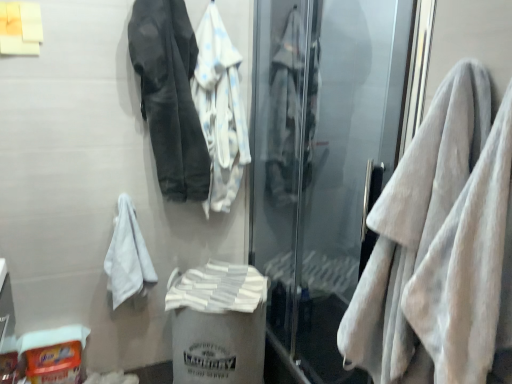
Question: From a real-world perspective, is white fluffy towel at right, positioned as the 1th towel in right-to-left order, located higher than white cotton jacket at upper center, marked as the 2th jacket in a left-to-right arrangement?

Choices:
 (A) yes
 (B) no

Answer: (B)

Question: Is white fluffy towel at right, positioned as the 1th towel in right-to-left order, positioned in front of white cotton jacket at upper center, marked as the 2th jacket in a left-to-right arrangement?

Choices:
 (A) yes
 (B) no

Answer: (A)

Question: Is white fluffy towel at right, which is the second towel from back to front, not within white cotton jacket at upper center, marked as the 2th jacket in a left-to-right arrangement?

Choices:
 (A) yes
 (B) no

Answer: (A)

Question: Considering the relative positions of white fluffy towel at right, the second towel viewed from the left, and white cotton jacket at upper center, the first jacket in the right-to-left sequence, in the image provided, is white fluffy towel at right, the second towel viewed from the left, to the left of white cotton jacket at upper center, the first jacket in the right-to-left sequence, from the viewer's perspective?

Choices:
 (A) no
 (B) yes

Answer: (A)

Question: Is white fluffy towel at right, positioned as the 1th towel in right-to-left order, smaller than white cotton jacket at upper center, marked as the 2th jacket in a left-to-right arrangement?

Choices:
 (A) yes
 (B) no

Answer: (B)

Question: Is white fluffy towel at right, the second towel viewed from the left, bigger than white cotton jacket at upper center, the first jacket in the right-to-left sequence?

Choices:
 (A) yes
 (B) no

Answer: (A)

Question: Is white fluffy towel at right, positioned as the 1th towel in right-to-left order, beside white soft bath towel at center?

Choices:
 (A) yes
 (B) no

Answer: (B)

Question: Is white fluffy towel at right, which is the first towel from front to back, located outside white soft bath towel at center?

Choices:
 (A) yes
 (B) no

Answer: (A)

Question: Is white soft bath towel at center completely or partially inside white fluffy towel at right, the second towel viewed from the left?

Choices:
 (A) no
 (B) yes

Answer: (A)

Question: Can you confirm if white fluffy towel at right, positioned as the 1th towel in right-to-left order, is wider than white soft bath towel at center?

Choices:
 (A) yes
 (B) no

Answer: (B)

Question: Can you confirm if white fluffy towel at right, positioned as the 1th towel in right-to-left order, is thinner than white soft bath towel at center?

Choices:
 (A) no
 (B) yes

Answer: (B)

Question: Considering the relative positions of white fluffy towel at right, positioned as the 1th towel in right-to-left order, and white soft bath towel at center in the image provided, is white fluffy towel at right, positioned as the 1th towel in right-to-left order, to the left of white soft bath towel at center from the viewer's perspective?

Choices:
 (A) no
 (B) yes

Answer: (A)

Question: Is dark gray fabric jacket at upper left, the second jacket positioned from the right, not close to white plastic bag at center, positioned as the 1th garbage in right-to-left order?

Choices:
 (A) yes
 (B) no

Answer: (B)